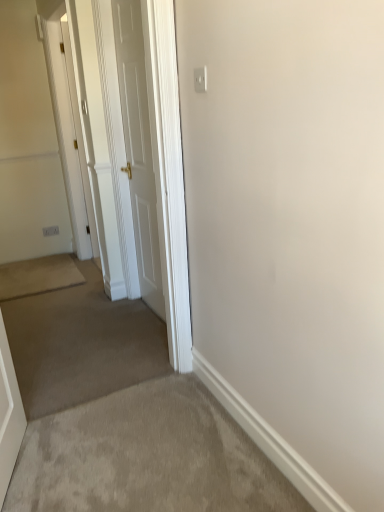
Where is `white glossy door at center, which ranks as the second door in left-to-right order`? The width and height of the screenshot is (384, 512). white glossy door at center, which ranks as the second door in left-to-right order is located at coordinates (138, 148).

This screenshot has height=512, width=384. What do you see at coordinates (138, 148) in the screenshot?
I see `white glossy door at center, the 2th door from the back` at bounding box center [138, 148].

The width and height of the screenshot is (384, 512). Find the location of `white glossy door at upper left, acting as the 2th door starting from the right`. white glossy door at upper left, acting as the 2th door starting from the right is located at coordinates (79, 138).

The height and width of the screenshot is (512, 384). Describe the element at coordinates (79, 138) in the screenshot. I see `white glossy door at upper left, the 1th door in the back-to-front sequence` at that location.

Image resolution: width=384 pixels, height=512 pixels. What are the coordinates of `white glossy door at center, which ranks as the second door in left-to-right order` in the screenshot? It's located at (138, 148).

Based on their positions, is white glossy door at upper left, the 1th door in the back-to-front sequence, located to the left or right of white glossy door at center, which ranks as the second door in left-to-right order?

In the image, white glossy door at upper left, the 1th door in the back-to-front sequence, appears on the left side of white glossy door at center, which ranks as the second door in left-to-right order.

Is white glossy door at upper left, acting as the 2th door starting from the right, closer to camera compared to white glossy door at center, the 2th door from the back?

No, it is behind white glossy door at center, the 2th door from the back.

Does point (92, 242) appear closer or farther from the camera than point (140, 176)?

Point (92, 242) appears to be farther away from the viewer than point (140, 176).

Looking at this image, from the image's perspective, which is above, white glossy door at upper left, which appears as the 1th door when viewed from the left, or white glossy door at center, the 1th door from the front?

white glossy door at upper left, which appears as the 1th door when viewed from the left, appears higher in the image.

In the scene shown: From a real-world perspective, is white glossy door at upper left, acting as the 2th door starting from the right, located higher than white glossy door at center, marked as the first door in a right-to-left arrangement?

Yes, from a real-world perspective, white glossy door at upper left, acting as the 2th door starting from the right, is on top of white glossy door at center, marked as the first door in a right-to-left arrangement.

In terms of width, does white glossy door at upper left, which appears as the 1th door when viewed from the left, look wider or thinner when compared to white glossy door at center, which ranks as the second door in left-to-right order?

Clearly, white glossy door at upper left, which appears as the 1th door when viewed from the left, has less width compared to white glossy door at center, which ranks as the second door in left-to-right order.

Between white glossy door at upper left, the 1th door in the back-to-front sequence, and white glossy door at center, the 2th door from the back, which one has less height?

Standing shorter between the two is white glossy door at center, the 2th door from the back.

Who is smaller, white glossy door at upper left, acting as the 2th door starting from the right, or white glossy door at center, marked as the first door in a right-to-left arrangement?

Smaller between the two is white glossy door at upper left, acting as the 2th door starting from the right.

Which is correct: white glossy door at upper left, acting as the 2th door starting from the right, is inside white glossy door at center, the 2th door from the back, or outside of it?

white glossy door at upper left, acting as the 2th door starting from the right, is spatially situated outside white glossy door at center, the 2th door from the back.

Does white glossy door at upper left, the 1th door in the back-to-front sequence, touch white glossy door at center, which ranks as the second door in left-to-right order?

No, white glossy door at upper left, the 1th door in the back-to-front sequence, is not in contact with white glossy door at center, which ranks as the second door in left-to-right order.

Is white glossy door at upper left, which is the second door in front-to-back order, aimed at white glossy door at center, which ranks as the second door in left-to-right order?

Yes, white glossy door at upper left, which is the second door in front-to-back order, is oriented towards white glossy door at center, which ranks as the second door in left-to-right order.

From the picture: How many degrees apart are the facing directions of white glossy door at upper left, which appears as the 1th door when viewed from the left, and white glossy door at center, marked as the first door in a right-to-left arrangement?

There is a 87.8-degree angle between the facing directions of white glossy door at upper left, which appears as the 1th door when viewed from the left, and white glossy door at center, marked as the first door in a right-to-left arrangement.

You are a GUI agent. You are given a task and a screenshot of the screen. Output one action in this format:
    pyautogui.click(x=<x>, y=<y>)
    Task: Click on the door in front of the white glossy door at upper left, acting as the 2th door starting from the right
    The width and height of the screenshot is (384, 512).
    Given the screenshot: What is the action you would take?
    pyautogui.click(x=138, y=148)

Does white glossy door at center, the 1th door from the front, appear on the left side of white glossy door at upper left, the 1th door in the back-to-front sequence?

Incorrect, white glossy door at center, the 1th door from the front, is not on the left side of white glossy door at upper left, the 1th door in the back-to-front sequence.

Which is in front, white glossy door at center, marked as the first door in a right-to-left arrangement, or white glossy door at upper left, which is the second door in front-to-back order?

white glossy door at center, marked as the first door in a right-to-left arrangement, is closer to the camera.

Which point is more distant from viewer, (129, 36) or (76, 104)?

The point (76, 104) is farther.

From the image's perspective, who appears lower, white glossy door at center, marked as the first door in a right-to-left arrangement, or white glossy door at upper left, the 1th door in the back-to-front sequence?

From the image's view, white glossy door at center, marked as the first door in a right-to-left arrangement, is below.

From a real-world perspective, is white glossy door at center, marked as the first door in a right-to-left arrangement, under white glossy door at upper left, acting as the 2th door starting from the right?

Correct, in the physical world, white glossy door at center, marked as the first door in a right-to-left arrangement, is lower than white glossy door at upper left, acting as the 2th door starting from the right.

Is white glossy door at center, marked as the first door in a right-to-left arrangement, wider than white glossy door at upper left, the 1th door in the back-to-front sequence?

Yes.

Can you confirm if white glossy door at center, the 2th door from the back, is shorter than white glossy door at upper left, acting as the 2th door starting from the right?

Yes, white glossy door at center, the 2th door from the back, is shorter than white glossy door at upper left, acting as the 2th door starting from the right.

Based on their sizes in the image, would you say white glossy door at center, the 1th door from the front, is bigger or smaller than white glossy door at upper left, acting as the 2th door starting from the right?

Considering their sizes, white glossy door at center, the 1th door from the front, takes up more space than white glossy door at upper left, acting as the 2th door starting from the right.

Is white glossy door at center, the 2th door from the back, surrounding white glossy door at upper left, which is the second door in front-to-back order?

No, white glossy door at upper left, which is the second door in front-to-back order, is not inside white glossy door at center, the 2th door from the back.

Would you consider white glossy door at center, marked as the first door in a right-to-left arrangement, to be distant from white glossy door at upper left, which appears as the 1th door when viewed from the left?

Yes.

Does white glossy door at center, the 2th door from the back, turn towards white glossy door at upper left, which appears as the 1th door when viewed from the left?

No, white glossy door at center, the 2th door from the back, is not oriented towards white glossy door at upper left, which appears as the 1th door when viewed from the left.

At what (x,y) coordinates should I click in order to perform the action: click on door above the white glossy door at center, which ranks as the second door in left-to-right order (from the image's perspective). Please return your answer as a coordinate pair (x, y). Looking at the image, I should click on (79, 138).

You are a GUI agent. You are given a task and a screenshot of the screen. Output one action in this format:
    pyautogui.click(x=<x>, y=<y>)
    Task: Click on the door on the left side of white glossy door at center, marked as the first door in a right-to-left arrangement
    
    Given the screenshot: What is the action you would take?
    pyautogui.click(x=79, y=138)

Locate an element on the screen. door located above the white glossy door at center, the 1th door from the front (from a real-world perspective) is located at coordinates (79, 138).